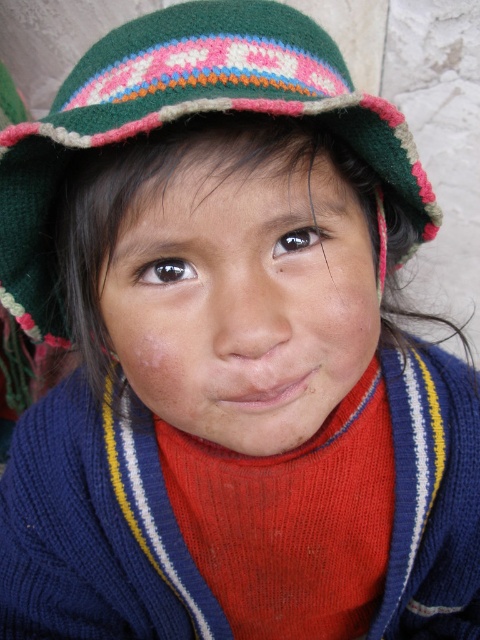
You are a photographer adjusting the focus on your camera. The subject is a child wearing a knitted hat with a green base and colorful band. You notice a point at coordinates (242, 292). What part of the child is this point likely indicating?

The point at coordinates (242, 292) corresponds to the smooth skin face at center, as indicated by the Objects Description.

Looking at the child in the traditional attire, which object has a smaller height between the smooth skin face at center and the green knitted hat at upper center?

The smooth skin face at center has a lesser height compared to the green knitted hat at upper center, so the smooth skin face at center is smaller in height.

Looking at the image of the child in traditional attire, which object takes up more space in the scene? Please consider the smooth skin face at center and the green knitted hat at upper center in your answer.

The green knitted hat at upper center occupies more space than the smooth skin face at center in the scene.